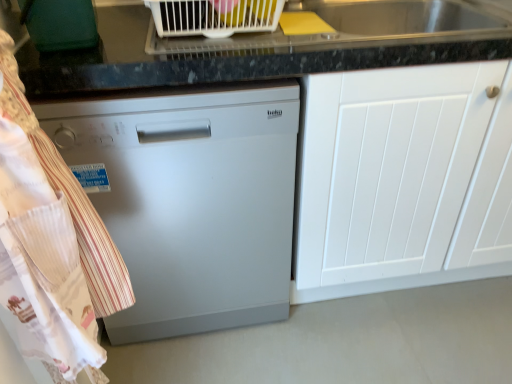
Question: Is white striped fabric at left aimed at satin silver dishwasher at center?

Choices:
 (A) no
 (B) yes

Answer: (A)

Question: Is white striped fabric at left not inside satin silver dishwasher at center?

Choices:
 (A) no
 (B) yes

Answer: (B)

Question: From the image's perspective, is white striped fabric at left over satin silver dishwasher at center?

Choices:
 (A) no
 (B) yes

Answer: (A)

Question: Considering the relative positions of white striped fabric at left and satin silver dishwasher at center in the image provided, is white striped fabric at left behind satin silver dishwasher at center?

Choices:
 (A) no
 (B) yes

Answer: (A)

Question: Is white striped fabric at left to the right of satin silver dishwasher at center from the viewer's perspective?

Choices:
 (A) no
 (B) yes

Answer: (A)

Question: Looking at their shapes, would you say white plastic dish rack at upper center is wider or thinner than white matte cabinet at center?

Choices:
 (A) wide
 (B) thin

Answer: (B)

Question: From their relative heights in the image, would you say white plastic dish rack at upper center is taller or shorter than white matte cabinet at center?

Choices:
 (A) short
 (B) tall

Answer: (A)

Question: Based on their positions, is white plastic dish rack at upper center located to the left or right of white matte cabinet at center?

Choices:
 (A) right
 (B) left

Answer: (B)

Question: Which is correct: white plastic dish rack at upper center is inside white matte cabinet at center, or outside of it?

Choices:
 (A) inside
 (B) outside

Answer: (B)

Question: Is white matte cabinet at center wider or thinner than white striped fabric at left?

Choices:
 (A) wide
 (B) thin

Answer: (A)

Question: Which is correct: white matte cabinet at center is inside white striped fabric at left, or outside of it?

Choices:
 (A) inside
 (B) outside

Answer: (B)

Question: Is point (380, 269) positioned closer to the camera than point (73, 339)?

Choices:
 (A) farther
 (B) closer

Answer: (A)

Question: Relative to white striped fabric at left, is white matte cabinet at center in front or behind?

Choices:
 (A) front
 (B) behind

Answer: (B)

Question: Is point pos(112,168) positioned closer to the camera than point pos(409,233)?

Choices:
 (A) farther
 (B) closer

Answer: (B)

Question: Visually, is satin silver dishwasher at center positioned to the left or to the right of white matte cabinet at center?

Choices:
 (A) right
 (B) left

Answer: (B)